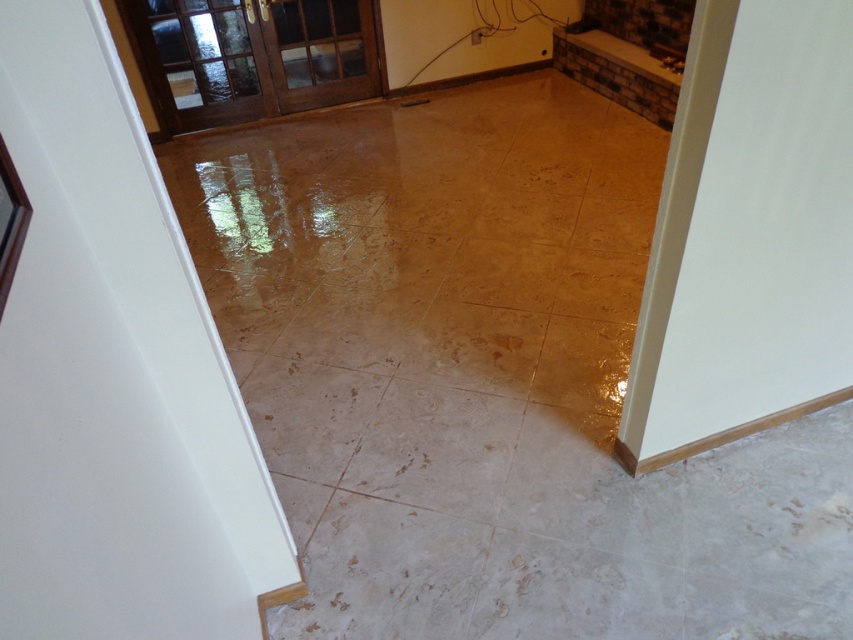
Who is more distant from viewer, [361,413] or [587,406]?

The point [361,413] is more distant.

Is beige marble tile at center shorter than shiny gold tile at lower right?

No.

Where is `beige marble tile at center`? This screenshot has height=640, width=853. beige marble tile at center is located at coordinates tap(309, 413).

Can you confirm if white marble tile at center is positioned below white marble tile at lower center?

Incorrect, white marble tile at center is not positioned below white marble tile at lower center.

Is white marble tile at center closer to the viewer compared to white marble tile at lower center?

No, it is not.

At what (x,y) coordinates should I click in order to perform the action: click on white marble tile at center. Please return your answer as a coordinate pair (x, y). This screenshot has width=853, height=640. Looking at the image, I should click on (436, 449).

This screenshot has height=640, width=853. What are the coordinates of `white marble tile at center` in the screenshot? It's located at (436, 449).

Between beige marble tile at center and white marble tile at lower center, which one appears on the left side from the viewer's perspective?

beige marble tile at center

Who is more distant from viewer, (369,394) or (309,525)?

Positioned behind is point (369,394).

The height and width of the screenshot is (640, 853). Describe the element at coordinates (309, 413) in the screenshot. I see `beige marble tile at center` at that location.

The height and width of the screenshot is (640, 853). I want to click on beige marble tile at center, so click(309, 413).